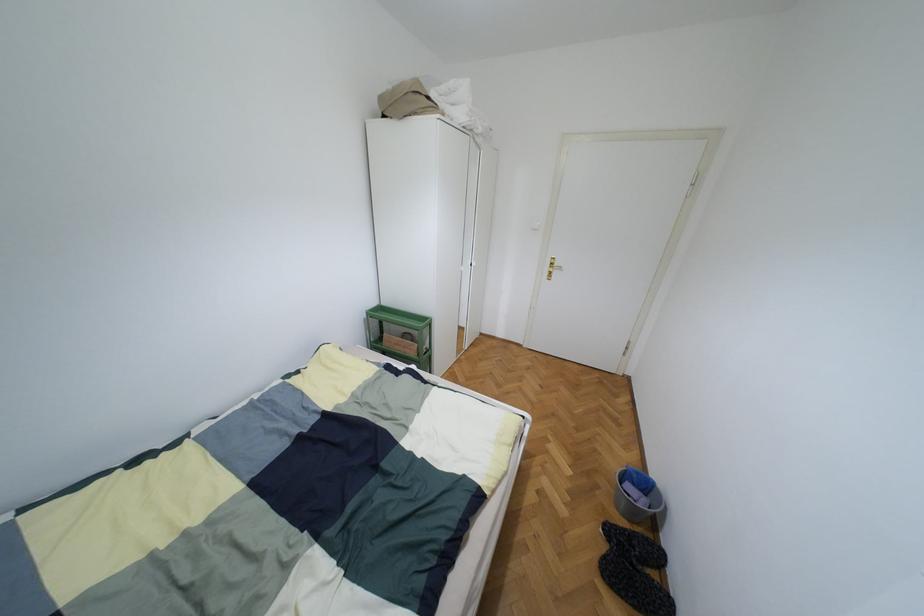
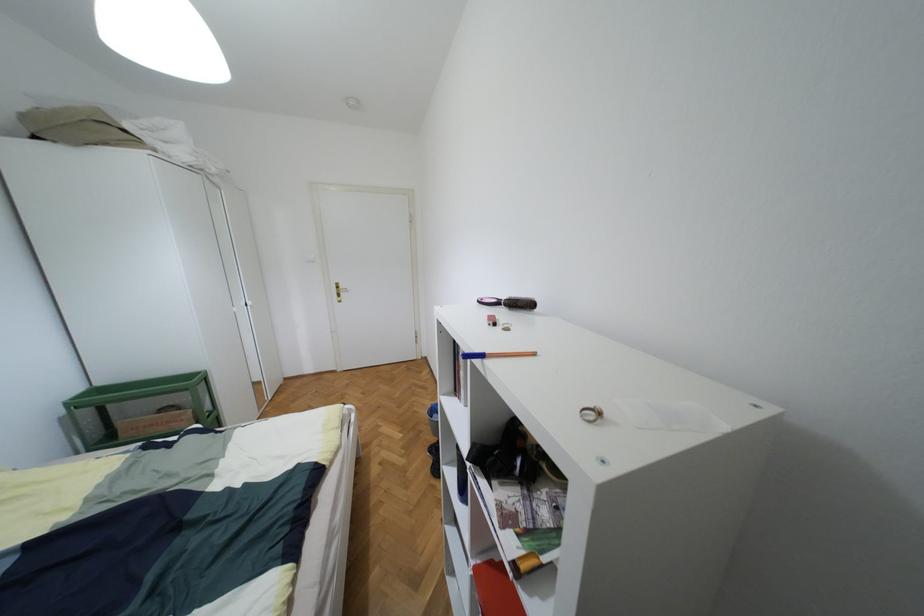
Question: The camera is either moving clockwise (left) or counter-clockwise (right) around the object. The first image is from the beginning of the video and the second image is from the end. Is the camera moving left or right when shooting the video?

Choices:
 (A) Left
 (B) Right

Answer: (A)